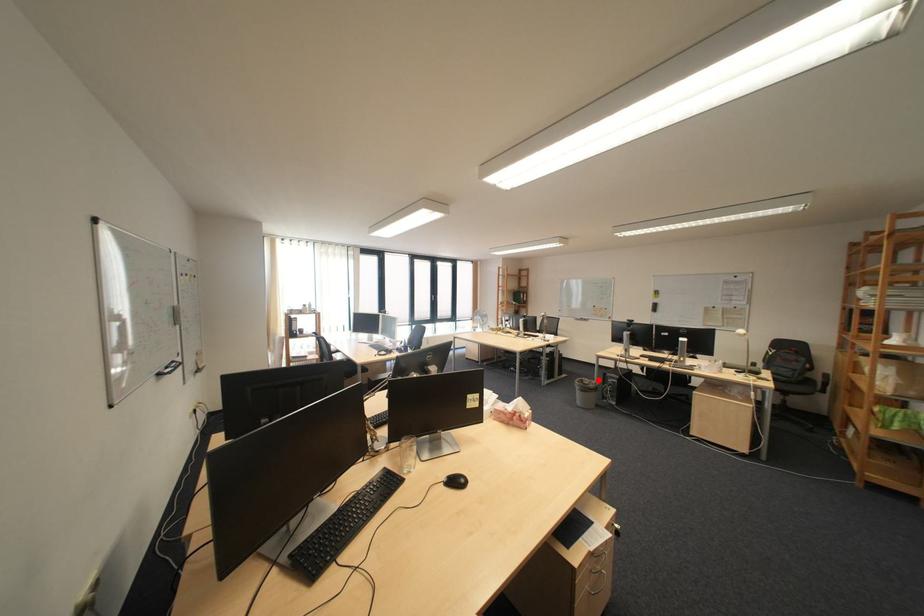
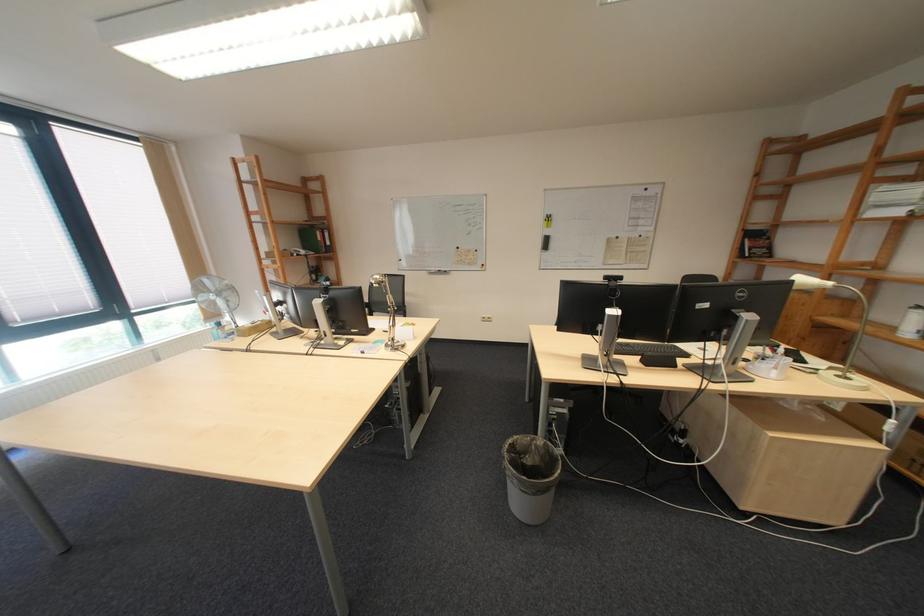
Question: I am providing you with two images of the same scene from different viewpoints. In image1, a red point is highlighted. Considering the same 3D point in image2, which of the following is correct?

Choices:
 (A) It is closer
 (B) It is farther

Answer: (A)